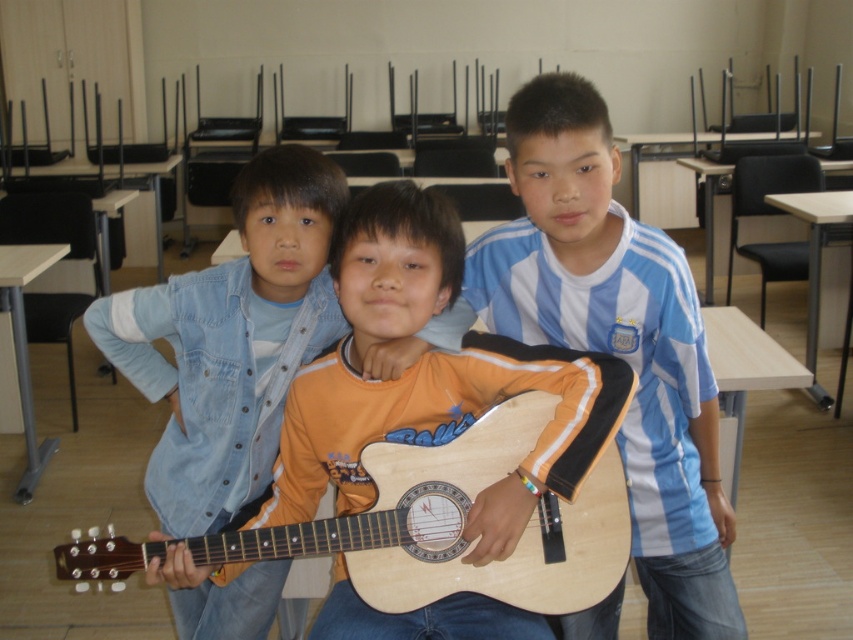
Question: Which point is farther from the camera taking this photo?

Choices:
 (A) (477, 492)
 (B) (402, 275)
 (C) (701, 541)

Answer: (C)

Question: Can you confirm if wooden guitar at center is positioned to the right of natural wood acoustic guitar at center?

Choices:
 (A) yes
 (B) no

Answer: (A)

Question: Can you confirm if wooden guitar at center is smaller than natural wood acoustic guitar at center?

Choices:
 (A) yes
 (B) no

Answer: (B)

Question: Estimate the real-world distances between objects in this image. Which object is closer to the blue striped shirt at center?

Choices:
 (A) wooden guitar at center
 (B) natural wood acoustic guitar at center

Answer: (A)

Question: Which point appears farthest from the camera in this image?

Choices:
 (A) (341, 365)
 (B) (543, 513)

Answer: (A)

Question: Is blue striped shirt at center bigger than wooden guitar at center?

Choices:
 (A) no
 (B) yes

Answer: (B)